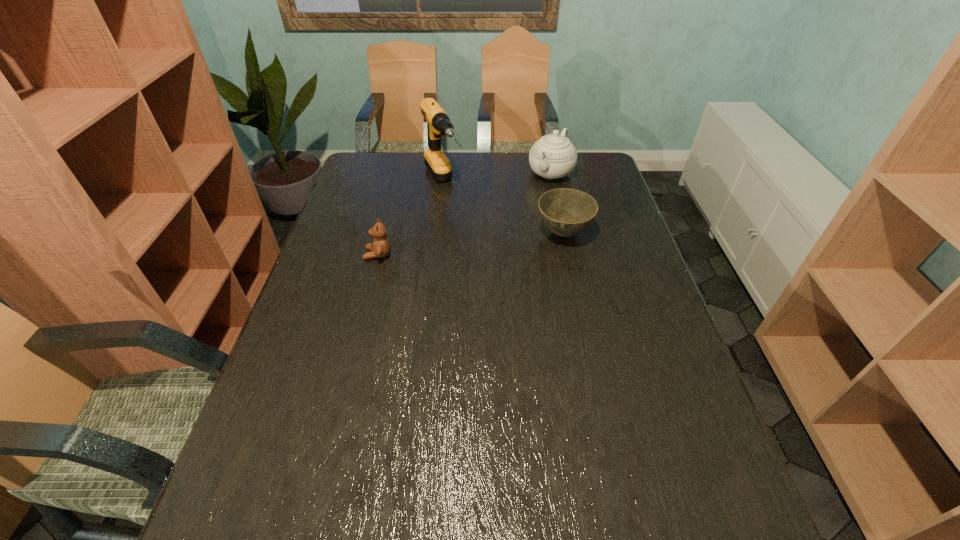
Locate an element on the screen. The image size is (960, 540). vacant area situated on the spout of the chinaware is located at coordinates (518, 217).

This screenshot has height=540, width=960. What are the coordinates of `vacant space located on the spout of the chinaware` in the screenshot? It's located at point(505,234).

What are the coordinates of `vacant space situated on the spout of the chinaware` in the screenshot? It's located at (534, 198).

Find the location of `drill that is positioned at the far edge`. drill that is positioned at the far edge is located at coordinates (438, 123).

Where is `chinaware that is at the far edge`? This screenshot has height=540, width=960. chinaware that is at the far edge is located at coordinates (553, 156).

Locate an element on the screen. object present at the left edge is located at coordinates (380, 248).

This screenshot has height=540, width=960. I want to click on bowl that is at the right edge, so click(566, 212).

Where is `chinaware present at the right edge`? The height and width of the screenshot is (540, 960). chinaware present at the right edge is located at coordinates (553, 156).

At what (x,y) coordinates should I click in order to perform the action: click on object that is at the far right corner. Please return your answer as a coordinate pair (x, y). This screenshot has height=540, width=960. Looking at the image, I should click on (553, 156).

What are the coordinates of `vacant space at the far edge` in the screenshot? It's located at (517, 182).